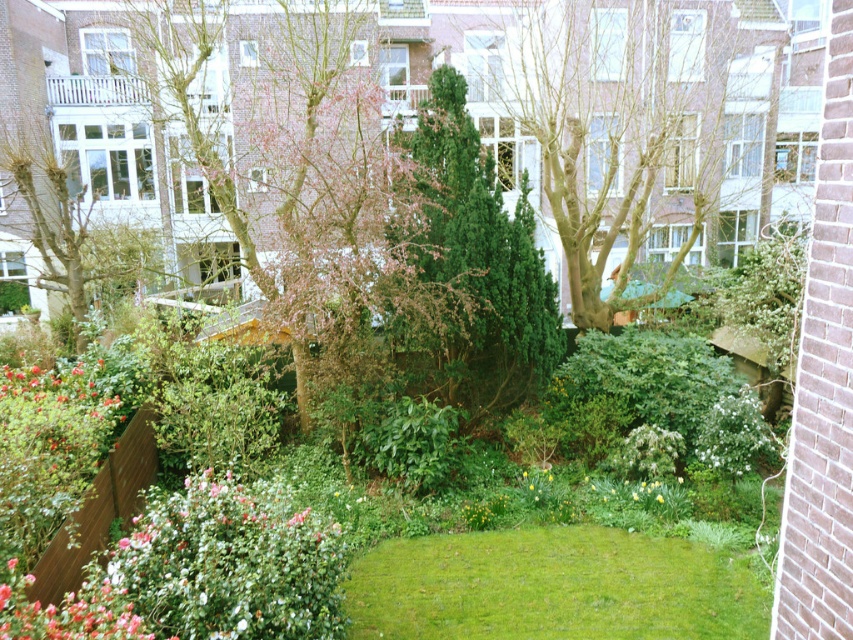
You are standing in the garden and want to take a photo of the bare brown tree at center. If your camera has a maximum focus range of 10 meters, will it be able to capture the tree clearly?

The bare brown tree at center is 9.68 meters away from the viewer. Since the camera can focus up to 10 meters, it will be able to capture the tree clearly within its range.

You are planning to place a small garden bench in the garden. The bench requires a space wider than the green textured bush at center. Can the area next to the bare brown tree at center accommodate the bench?

The bare brown tree at center has a larger width than the green textured bush at center, so the area next to the bare brown tree at center can accommodate the bench since it provides sufficient space.